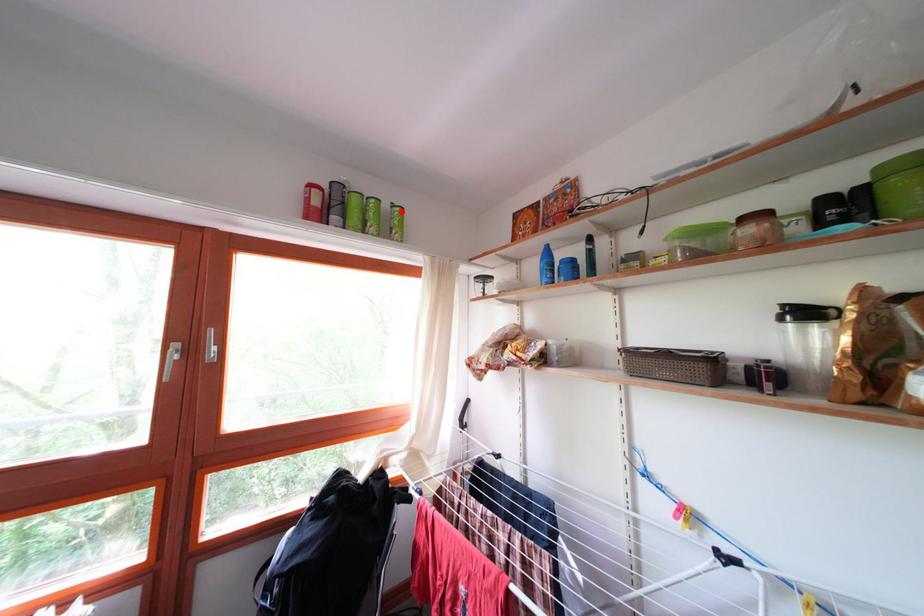
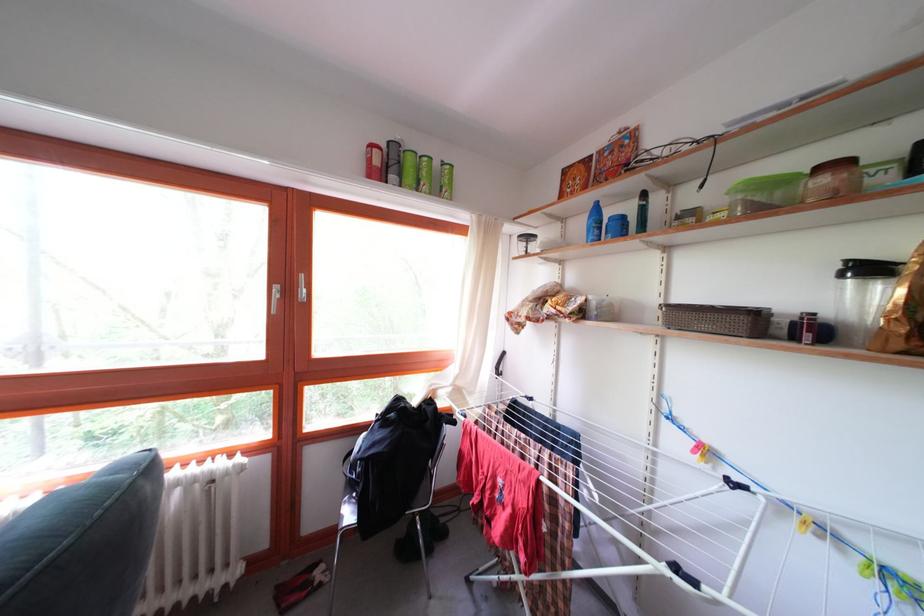
Where in the second image is the point corresponding to the highlighted location from the first image?

(452, 169)